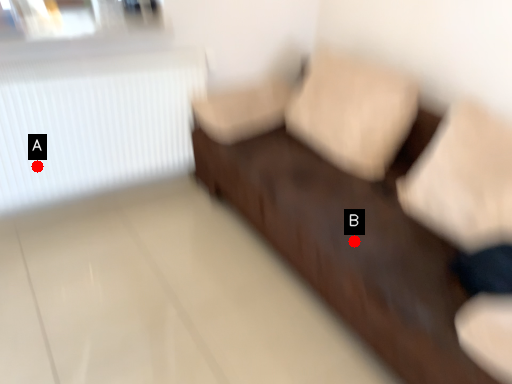
Question: Two points are circled on the image, labeled by A and B beside each circle. Which point is closer to the camera taking this photo?

Choices:
 (A) A is closer
 (B) B is closer

Answer: (B)